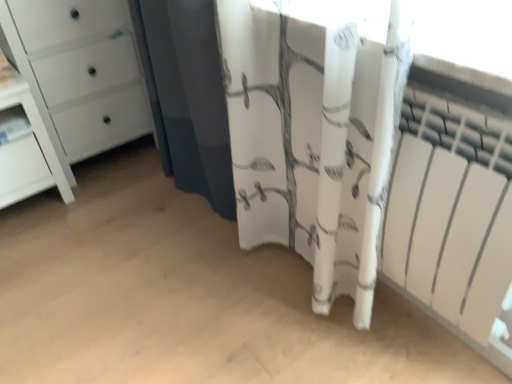
Question: Considering the relative positions of white floral fabric at center and white glossy chest of drawers at left in the image provided, is white floral fabric at center behind white glossy chest of drawers at left?

Choices:
 (A) no
 (B) yes

Answer: (A)

Question: Considering the relative sizes of white floral fabric at center and white glossy chest of drawers at left in the image provided, is white floral fabric at center thinner than white glossy chest of drawers at left?

Choices:
 (A) no
 (B) yes

Answer: (B)

Question: Does white floral fabric at center touch white glossy chest of drawers at left?

Choices:
 (A) yes
 (B) no

Answer: (B)

Question: Considering the relative sizes of white floral fabric at center and white glossy chest of drawers at left in the image provided, is white floral fabric at center taller than white glossy chest of drawers at left?

Choices:
 (A) yes
 (B) no

Answer: (A)

Question: Does white floral fabric at center have a greater width compared to white glossy chest of drawers at left?

Choices:
 (A) yes
 (B) no

Answer: (B)

Question: Considering the relative positions of white floral fabric at center and white glossy chest of drawers at left in the image provided, is white floral fabric at center to the right of white glossy chest of drawers at left from the viewer's perspective?

Choices:
 (A) yes
 (B) no

Answer: (A)

Question: From a real-world perspective, is white glossy bookshelf at left over white matte radiator at right?

Choices:
 (A) yes
 (B) no

Answer: (B)

Question: From the image's perspective, is white glossy bookshelf at left located beneath white matte radiator at right?

Choices:
 (A) no
 (B) yes

Answer: (A)

Question: Can you see white glossy bookshelf at left touching white matte radiator at right?

Choices:
 (A) no
 (B) yes

Answer: (A)

Question: Is there a large distance between white glossy bookshelf at left and white matte radiator at right?

Choices:
 (A) no
 (B) yes

Answer: (B)

Question: Does white glossy bookshelf at left have a lesser height compared to white matte radiator at right?

Choices:
 (A) yes
 (B) no

Answer: (A)

Question: Does white glossy bookshelf at left lie in front of white matte radiator at right?

Choices:
 (A) no
 (B) yes

Answer: (A)

Question: Is white fabric curtain at center at the back of white matte radiator at right?

Choices:
 (A) no
 (B) yes

Answer: (A)